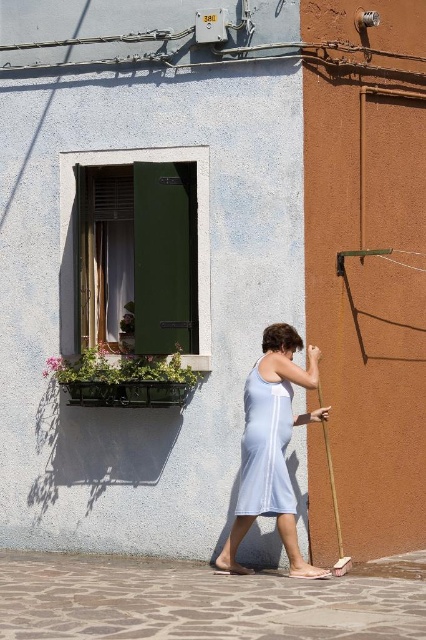
Which of these two, light blue fabric dress at center or green wooden window box at left, stands shorter?

Standing shorter between the two is green wooden window box at left.

Which is behind, point (253, 500) or point (161, 385)?

Point (161, 385)

Image resolution: width=426 pixels, height=640 pixels. I want to click on light blue fabric dress at center, so click(x=264, y=449).

Can you confirm if green matte door at upper left is wider than green wooden window box at left?

Yes.

Who is more distant from viewer, (198, 317) or (98, 403)?

Point (98, 403)

You are a GUI agent. You are given a task and a screenshot of the screen. Output one action in this format:
    pyautogui.click(x=<x>, y=<y>)
    Task: Click on the green matte door at upper left
    This screenshot has height=640, width=426.
    Given the screenshot: What is the action you would take?
    pyautogui.click(x=196, y=227)

Can you confirm if white cotton dress at center is positioned below light blue fabric dress at center?

Correct, white cotton dress at center is located below light blue fabric dress at center.

Does white cotton dress at center have a greater width compared to light blue fabric dress at center?

Correct, the width of white cotton dress at center exceeds that of light blue fabric dress at center.

Is point (284, 474) closer to camera compared to point (244, 506)?

Yes, it is in front of point (244, 506).

Locate an element on the screen. white cotton dress at center is located at coordinates (271, 448).